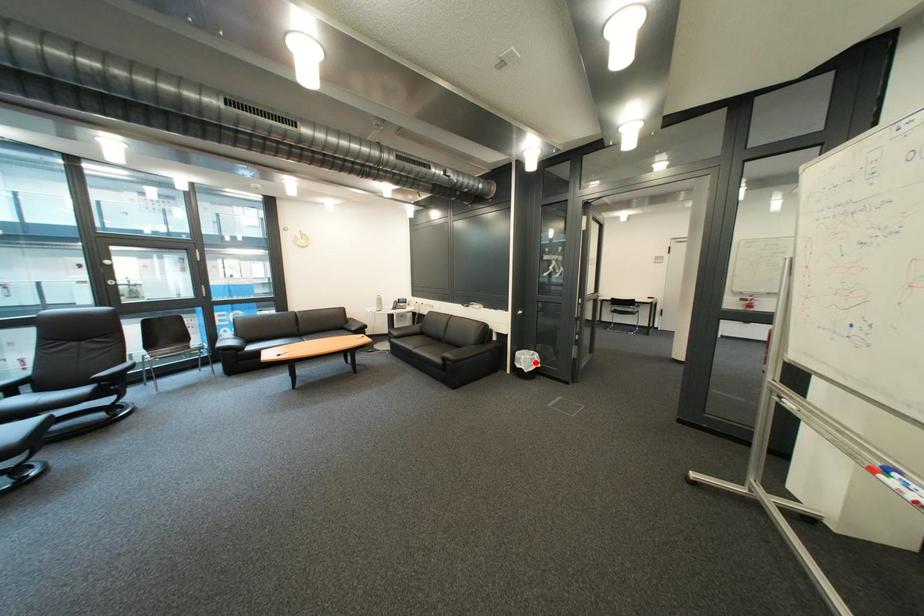
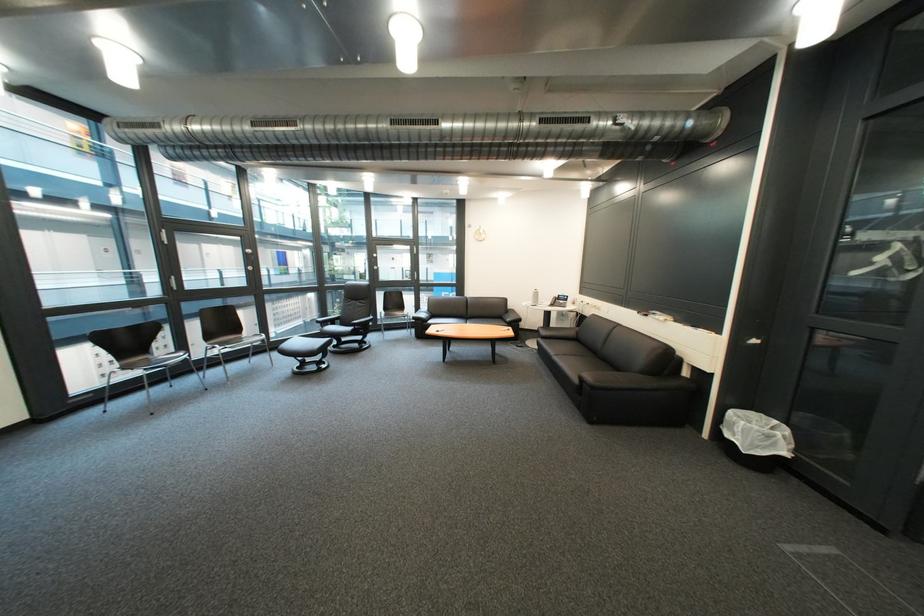
Question: I am providing you with two images of the same scene from different viewpoints. Given a red point in image1, look at the same physical point in image2. Is it:

Choices:
 (A) Closer to the viewpoint
 (B) Farther from the viewpoint

Answer: (A)